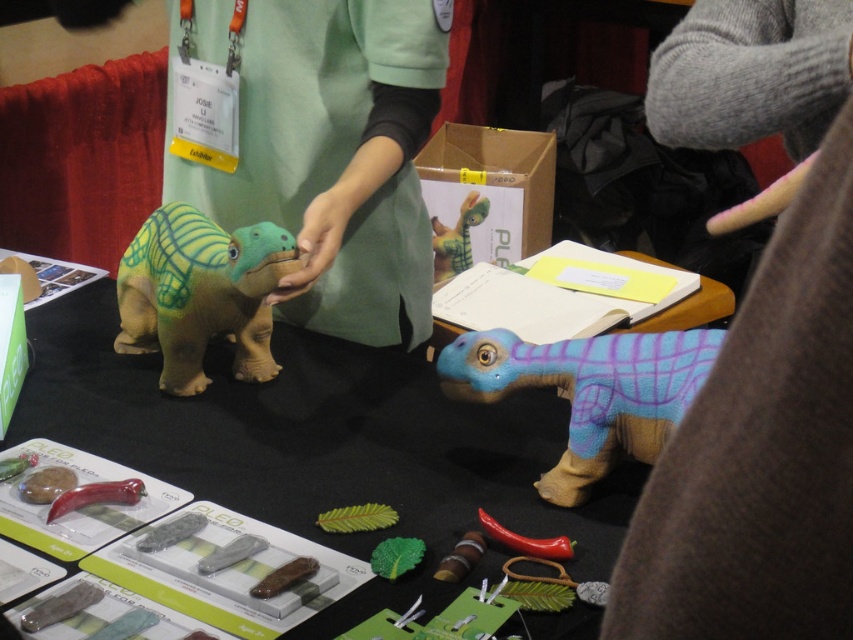
Question: Which of the following is the closest to the observer?

Choices:
 (A) (524, 465)
 (B) (451, 346)
 (C) (486, 202)

Answer: (B)

Question: Estimate the real-world distances between objects in this image. Which object is closer to the textured green plush dinosaur at center?

Choices:
 (A) brown matte table at center
 (B) gray wool sweater at upper right
 (C) green fabric dinosaur at center
 (D) soft plush dinosaur at center

Answer: (A)

Question: Which point is farther from the camera taking this photo?

Choices:
 (A) (454, 234)
 (B) (735, 12)
 (C) (447, 61)
 (D) (206, 280)

Answer: (A)

Question: Can you confirm if gray wool sweater at upper right is smaller than soft plush dinosaur at center?

Choices:
 (A) no
 (B) yes

Answer: (B)

Question: Can you confirm if gray wool sweater at upper right is thinner than brown matte table at center?

Choices:
 (A) no
 (B) yes

Answer: (B)

Question: Is brown matte table at center to the left of blue fabric dinosaur at center from the viewer's perspective?

Choices:
 (A) no
 (B) yes

Answer: (B)